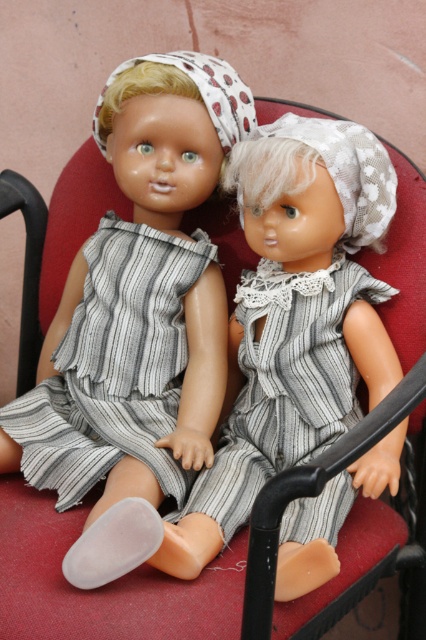
You are a fashion designer looking at two dolls wearing dresses. You see the gray striped fabric dress at left and the striped fabric dress at center. Which dress is located to the left of the other?

The gray striped fabric dress at left is positioned on the left side of striped fabric dress at center.

You are a tailor who needs to adjust the length of two dolls dresses. The gray striped fabric dress at left and the striped fabric dress at center are both in need of alterations. Based on the image, which dress requires shortening to match the other?

The gray striped fabric dress at left is much taller than the striped fabric dress at center, so the gray striped fabric dress at left requires shortening to match the striped fabric dress at center.

You are a tailor who needs to determine which dress requires more fabric to make between the gray striped fabric dress at left and the striped fabric dress at center. Based on the image, which dress would need more fabric?

The striped fabric dress at center requires more fabric because it occupies more space than the gray striped fabric dress at left.